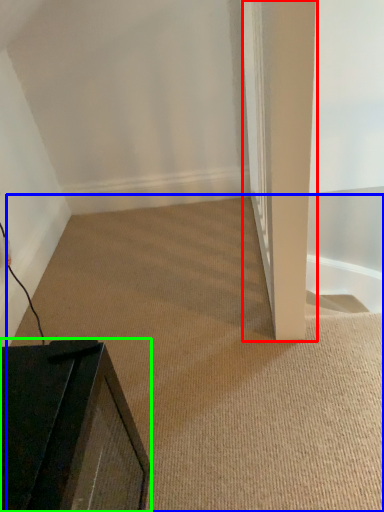
Question: Based on their relative distances, which object is farther from pillar (highlighted by a red box)? Choose from plain (highlighted by a blue box) and furniture (highlighted by a green box).

Choices:
 (A) plain
 (B) furniture

Answer: (B)